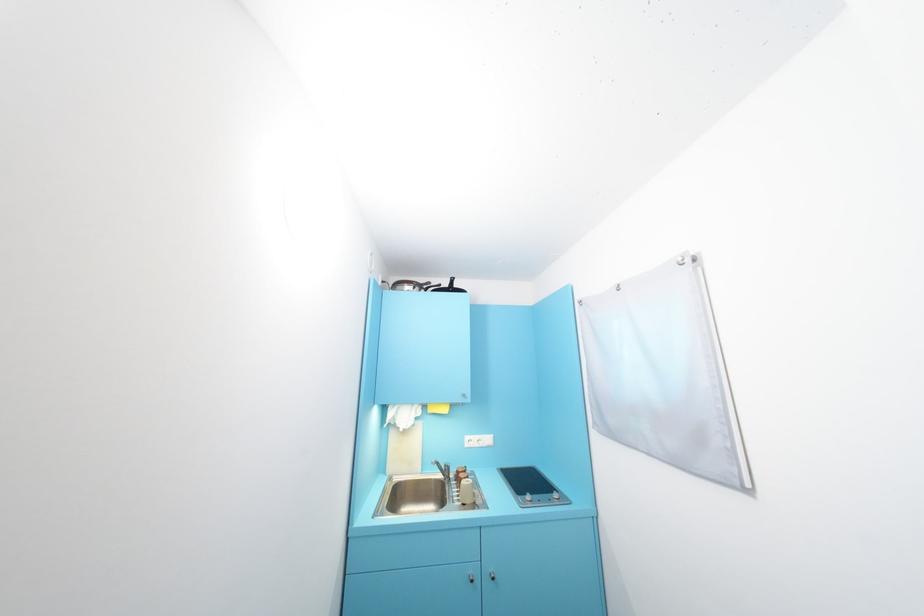
The width and height of the screenshot is (924, 616). In order to click on faucet handle in this screenshot , I will do `click(442, 469)`.